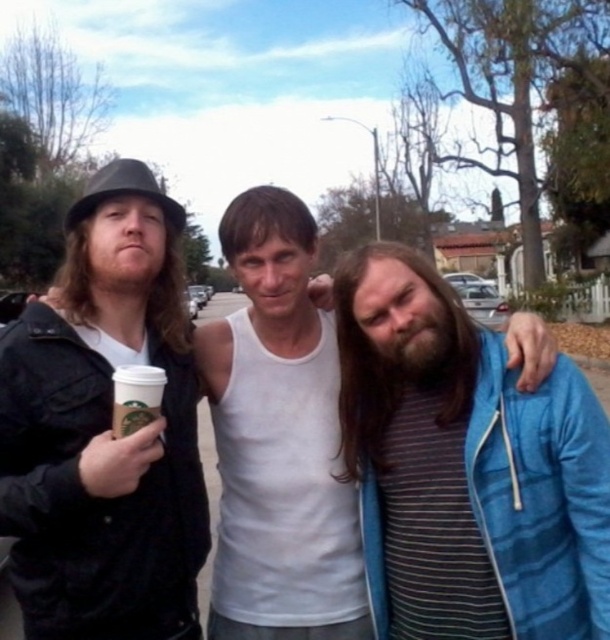
Question: Which object is closer to the camera taking this photo?

Choices:
 (A) black matte hat at upper left
 (B) white paper cup at center
 (C) striped cotton shirt at center

Answer: (B)

Question: Does striped cotton shirt at center appear over white cotton tank top at center?

Choices:
 (A) yes
 (B) no

Answer: (B)

Question: Among these points, which one is nearest to the camera?

Choices:
 (A) (156, 396)
 (B) (289, 584)
 (C) (387, 298)
 (D) (178, 211)

Answer: (A)

Question: Which of the following is the farthest from the observer?

Choices:
 (A) (254, 209)
 (B) (126, 227)
 (C) (154, 394)
 (D) (425, 625)

Answer: (A)

Question: Can you confirm if black matte hat at upper left is positioned below white paper cup at center?

Choices:
 (A) yes
 (B) no

Answer: (B)

Question: Is white cotton tank top at center positioned behind white paper cup at center?

Choices:
 (A) yes
 (B) no

Answer: (A)